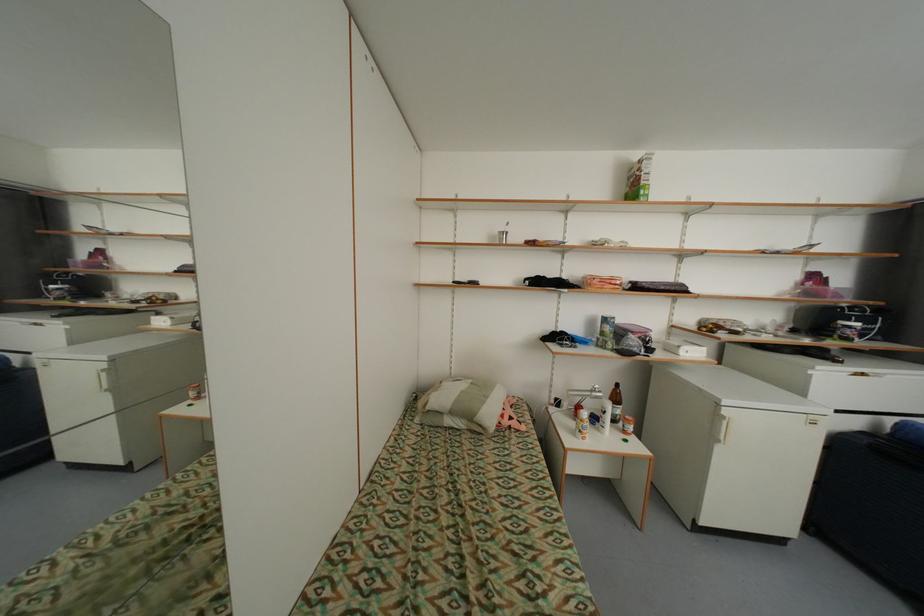
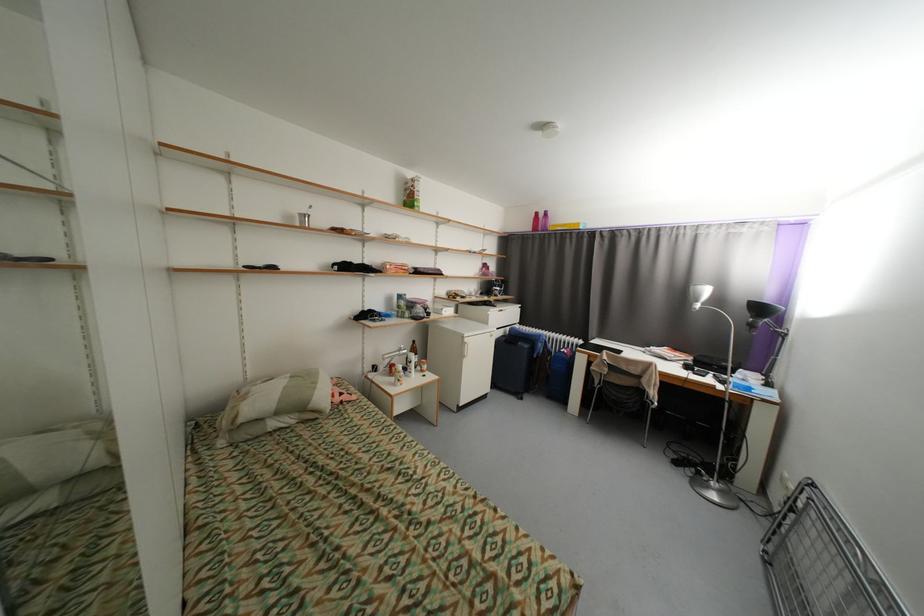
Where in the second image is the point corresponding to pixel 493 398 from the first image?

(322, 384)